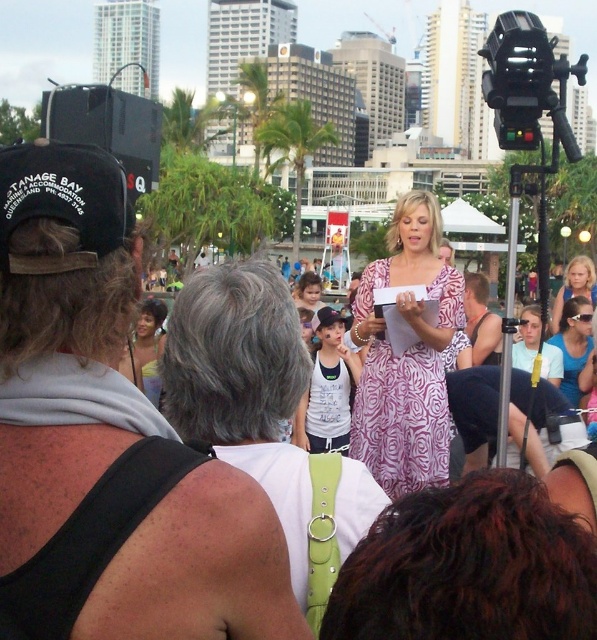
You are a photographer at the event and want to focus on the pink floral dress at center and blue fabric sunglasses at center. Which object should you adjust your camera to prioritize in terms of focus if you want the one closer to you to be sharp?

The pink floral dress at center is closer to the viewer than the blue fabric sunglasses at center, so you should prioritize focusing on the pink floral dress at center to ensure it is sharp.

You are a photographer standing at the scene. You want to take a photo that includes both the pink floral dress at center and the light blue denim shorts at center. The camera you are using has a maximum focus range of 20 meters. Can you capture both subjects clearly in the same photo?

The pink floral dress at center is 22.48 meters away from light blue denim shorts at center. Since the camera can only focus up to 20 meters, the distance between them exceeds the camera range. Therefore, you cannot capture both subjects clearly in the same photo.